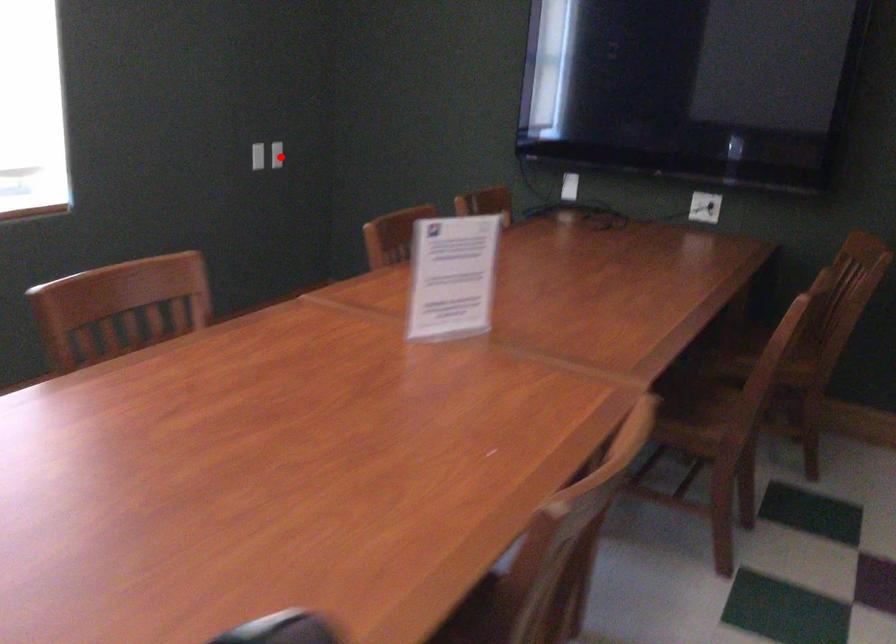
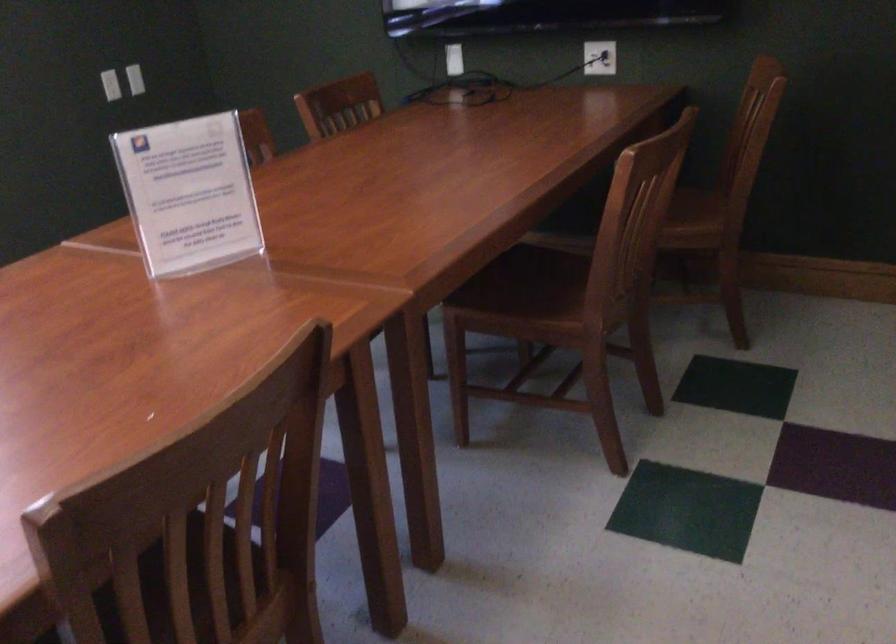
Where in the second image is the point corresponding to the highlighted location from the first image?

(134, 79)